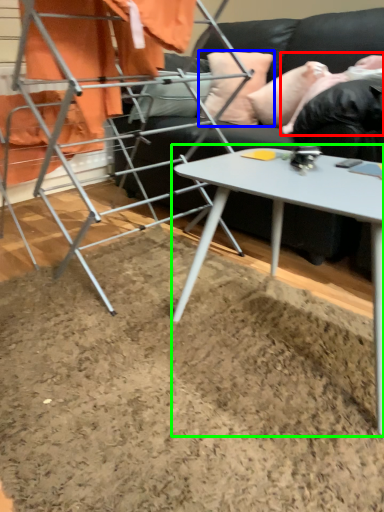
Question: Considering the real-world distances, which object is farthest from person (highlighted by a red box)? pillow (highlighted by a blue box) or table (highlighted by a green box)?

Choices:
 (A) pillow
 (B) table

Answer: (B)